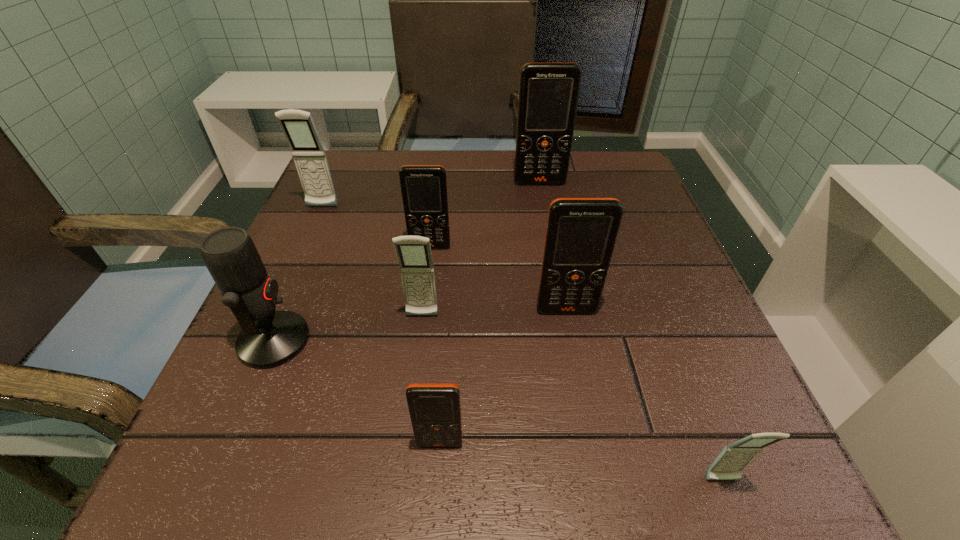
Locate an element on the screen. The image size is (960, 540). cellular telephone at the left edge is located at coordinates (309, 156).

Where is `microphone that is at the left edge`? microphone that is at the left edge is located at coordinates (269, 338).

Find the location of `object that is positioned at the right edge`. object that is positioned at the right edge is located at coordinates (728, 465).

Where is `object located at the far left corner`? object located at the far left corner is located at coordinates (309, 156).

Where is `object situated at the near right corner`? object situated at the near right corner is located at coordinates (728, 465).

Locate an element on the screen. This screenshot has height=540, width=960. free space at the far edge of the desktop is located at coordinates (440, 156).

Image resolution: width=960 pixels, height=540 pixels. In the image, there is a desktop. Identify the location of vacant space at the near edge. (542, 450).

This screenshot has height=540, width=960. In order to click on vacant point at the left edge in this screenshot , I will do `click(337, 235)`.

Where is `free space at the right edge of the desktop`? The height and width of the screenshot is (540, 960). free space at the right edge of the desktop is located at coordinates (650, 260).

Where is `vacant area at the far left corner of the desktop`? This screenshot has height=540, width=960. vacant area at the far left corner of the desktop is located at coordinates (372, 170).